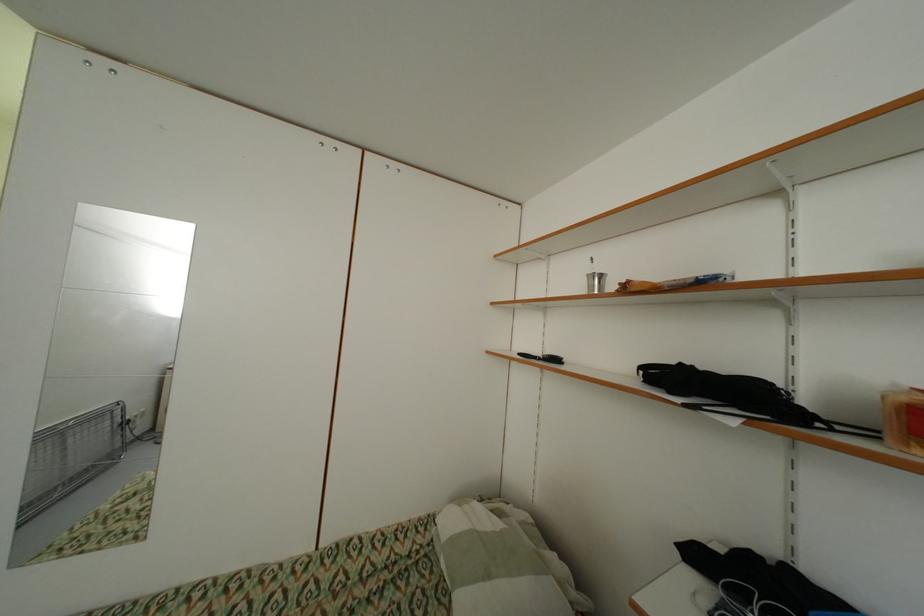
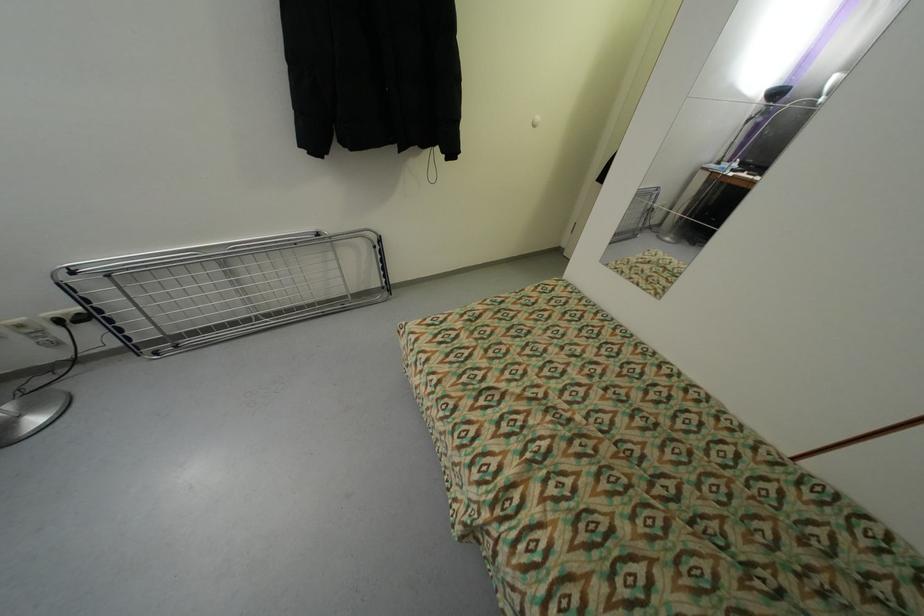
Based on the continuous images, in which direction is the camera rotating?

The camera's rotation is toward left-down.